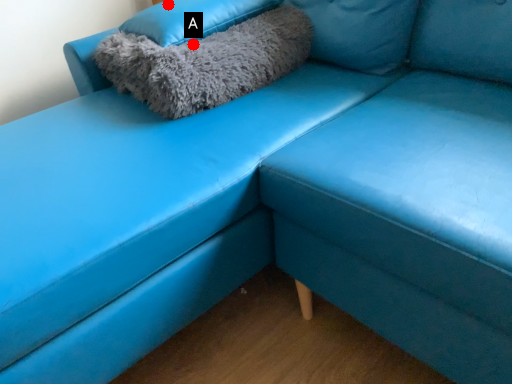
Question: Two points are circled on the image, labeled by A and B beside each circle. Which of the following is the closest to the observer?

Choices:
 (A) A is closer
 (B) B is closer

Answer: (A)